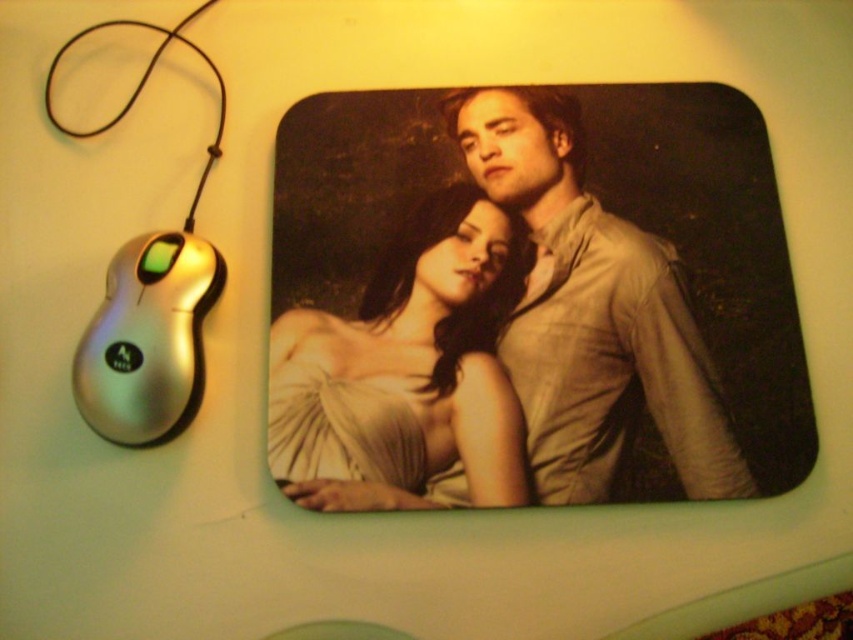
Question: Where is matte white dress at center located in relation to silver metallic mouse at left in the image?

Choices:
 (A) below
 (B) above

Answer: (A)

Question: Which point appears closest to the camera in this image?

Choices:
 (A) (105, 312)
 (B) (376, 348)

Answer: (A)

Question: Which object is positioned closest to the matte beige shirt at center?

Choices:
 (A) matte white dress at center
 (B) silver metallic mouse at left

Answer: (A)

Question: Can you confirm if matte beige shirt at center is positioned to the left of silver metallic mouse at left?

Choices:
 (A) no
 (B) yes

Answer: (A)

Question: Does matte beige shirt at center appear on the right side of matte white dress at center?

Choices:
 (A) yes
 (B) no

Answer: (A)

Question: Which of the following is the farthest from the observer?

Choices:
 (A) matte beige shirt at center
 (B) matte white dress at center
 (C) silver metallic mouse at left

Answer: (A)